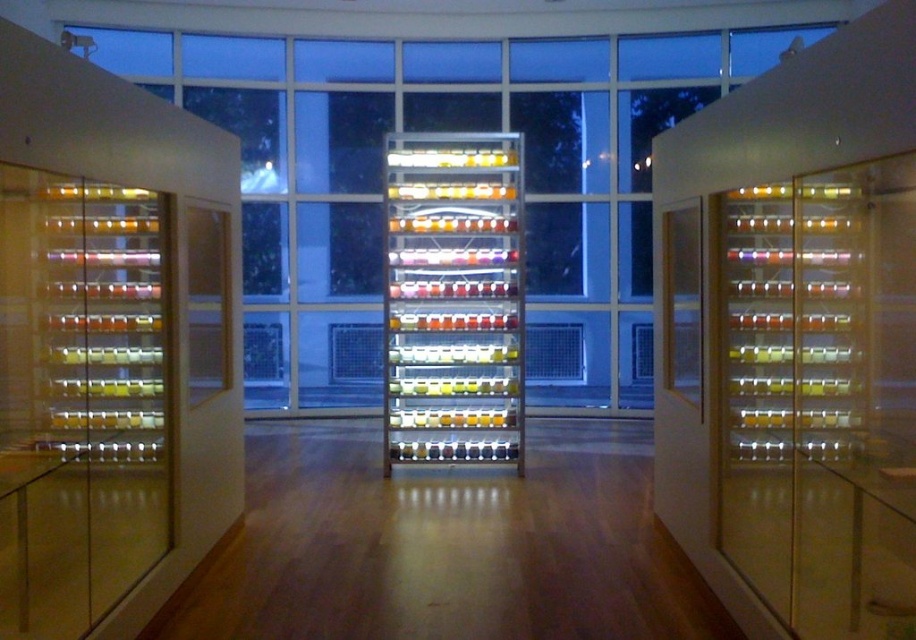
Is clear glass cabinet at right shorter than translucent plastic jars at center?

Indeed, clear glass cabinet at right has a lesser height compared to translucent plastic jars at center.

You are a GUI agent. You are given a task and a screenshot of the screen. Output one action in this format:
    pyautogui.click(x=<x>, y=<y>)
    Task: Click on the clear glass cabinet at right
    The width and height of the screenshot is (916, 640).
    Given the screenshot: What is the action you would take?
    pyautogui.click(x=820, y=396)

Locate an element on the screen. The width and height of the screenshot is (916, 640). clear glass cabinet at right is located at coordinates click(x=820, y=396).

Locate an element on the screen. The height and width of the screenshot is (640, 916). clear glass cabinet at right is located at coordinates (820, 396).

Locate an element on the screen. translucent glass shelves at left is located at coordinates pyautogui.click(x=79, y=397).

Does translucent glass shelves at left have a smaller size compared to translucent plastic jars at center?

Incorrect, translucent glass shelves at left is not smaller in size than translucent plastic jars at center.

Is point (64, 451) closer to viewer compared to point (518, 288)?

Yes, point (64, 451) is closer to viewer.

Identify the location of translucent glass shelves at left. The image size is (916, 640). (79, 397).

Is point (859, 545) closer to viewer compared to point (97, 275)?

Yes, point (859, 545) is in front of point (97, 275).

Image resolution: width=916 pixels, height=640 pixels. What do you see at coordinates (820, 396) in the screenshot?
I see `clear glass cabinet at right` at bounding box center [820, 396].

At what (x,y) coordinates should I click in order to perform the action: click on clear glass cabinet at right. Please return your answer as a coordinate pair (x, y). Looking at the image, I should click on (820, 396).